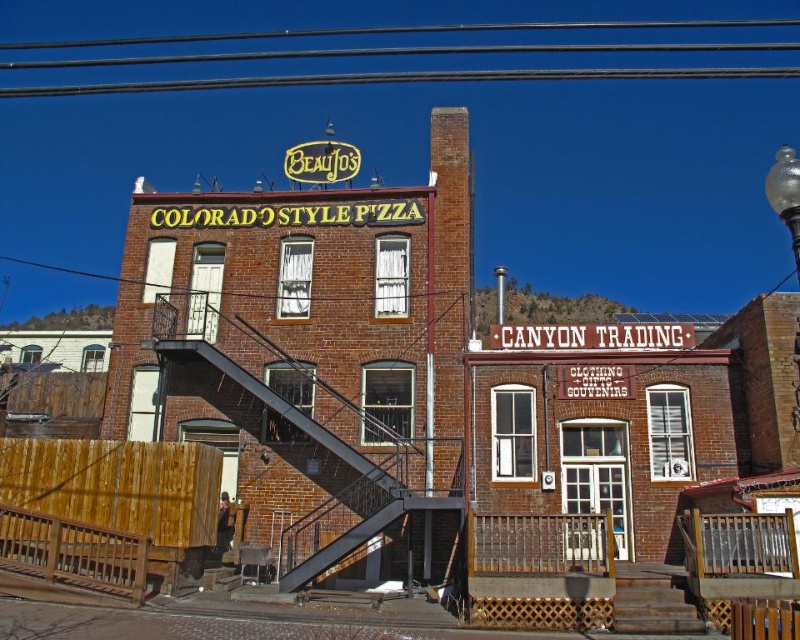
Is point (289, 417) closer to viewer compared to point (786, 170)?

No.

How far apart are metallic black staircase at center and transparent glass globe at upper right?

120.61 feet

Is point (352, 540) positioned behind point (770, 200)?

Yes.

The width and height of the screenshot is (800, 640). What are the coordinates of `metallic black staircase at center` in the screenshot? It's located at (324, 449).